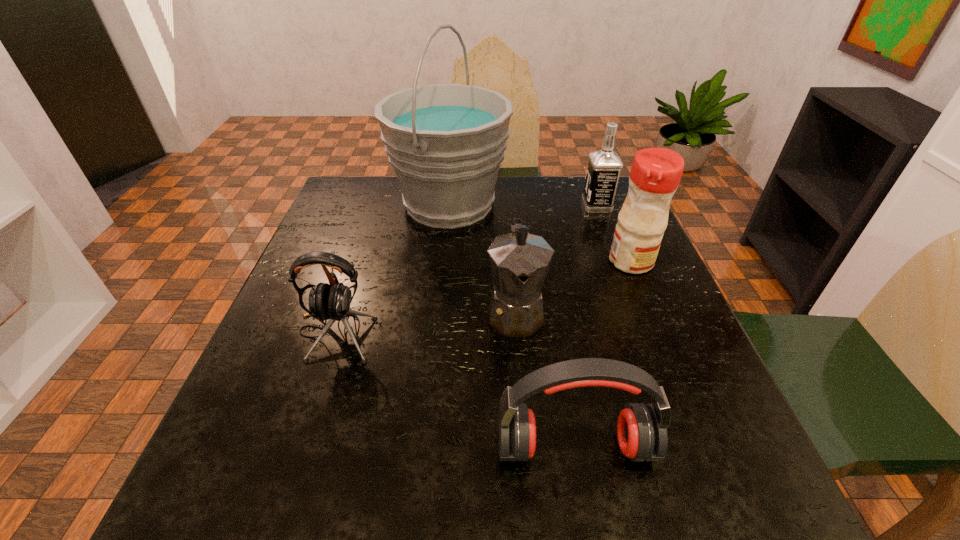
Image resolution: width=960 pixels, height=540 pixels. Find the location of `free region located on the front label of the vodka`. free region located on the front label of the vodka is located at coordinates (480, 206).

Identify the location of free space located on the front label of the vodka. This screenshot has width=960, height=540. (542, 206).

Find the location of a particular element. Image resolution: width=960 pixels, height=540 pixels. blank area located 0.270m on the front label of the vodka is located at coordinates (484, 206).

Where is `free space located 0.050m on the pouring side of the coffeepot`? This screenshot has height=540, width=960. free space located 0.050m on the pouring side of the coffeepot is located at coordinates (520, 370).

This screenshot has height=540, width=960. What are the coordinates of `vacant point located on the back of the left earphone` in the screenshot? It's located at (372, 221).

In order to click on bucket that is positioned at the far edge in this screenshot , I will do `click(445, 142)`.

The image size is (960, 540). Identify the location of vodka that is at the far edge. (604, 166).

The width and height of the screenshot is (960, 540). What are the coordinates of `object present at the near edge` in the screenshot? It's located at (641, 428).

This screenshot has height=540, width=960. I want to click on bucket positioned at the left edge, so click(x=445, y=142).

You are a GUI agent. You are given a task and a screenshot of the screen. Output one action in this format:
    pyautogui.click(x=<x>, y=<y>)
    Task: Click on the earphone that is at the left edge
    This screenshot has height=540, width=960.
    Given the screenshot: What is the action you would take?
    pyautogui.click(x=331, y=302)